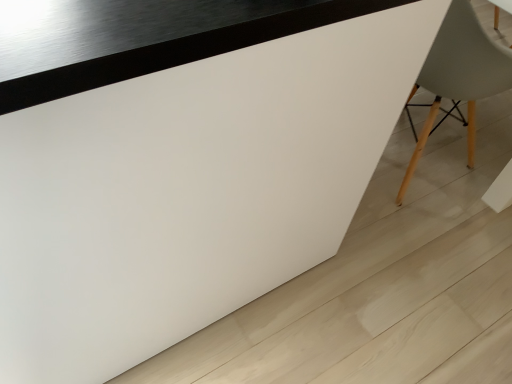
Describe the element at coordinates (459, 74) in the screenshot. The image size is (512, 384). I see `matte gray chair at right` at that location.

I want to click on matte gray chair at right, so click(459, 74).

You are a GUI agent. You are given a task and a screenshot of the screen. Output one action in this format:
    pyautogui.click(x=<x>, y=<y>)
    Task: Click on the matte gray chair at right
    
    Given the screenshot: What is the action you would take?
    pyautogui.click(x=459, y=74)